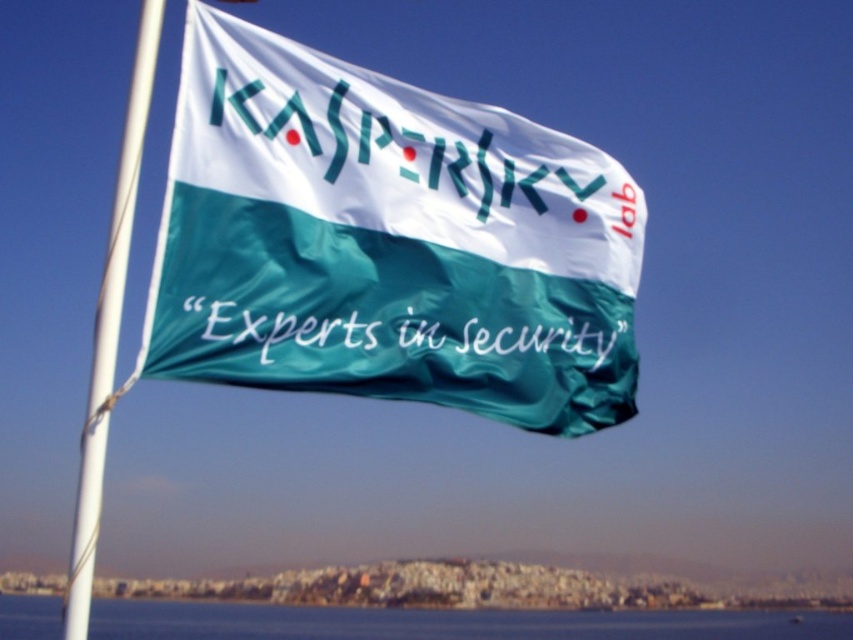
Where is `white plastic flag pole at left`? white plastic flag pole at left is located at coordinates (108, 330).

Can you confirm if white plastic flag pole at left is smaller than green fabric flag at center?

Incorrect, white plastic flag pole at left is not smaller in size than green fabric flag at center.

Is point (126, 150) positioned in front of point (457, 148)?

Yes, it is in front of point (457, 148).

The width and height of the screenshot is (853, 640). Identify the location of white plastic flag pole at left. (108, 330).

From the picture: Which is below, blue water at lower center or white plastic flag pole at left?

blue water at lower center is below.

Does blue water at lower center have a lesser height compared to white plastic flag pole at left?

No.

Who is more forward, [453,624] or [94,410]?

Point [94,410] is in front.

The width and height of the screenshot is (853, 640). I want to click on blue water at lower center, so click(445, 621).

Who is taller, silky green flag at center or blue water at lower center?

blue water at lower center

Does point (305, 276) lie in front of point (193, 620)?

Yes, it is in front of point (193, 620).

Image resolution: width=853 pixels, height=640 pixels. In order to click on silky green flag at center in this screenshot , I will do `click(387, 243)`.